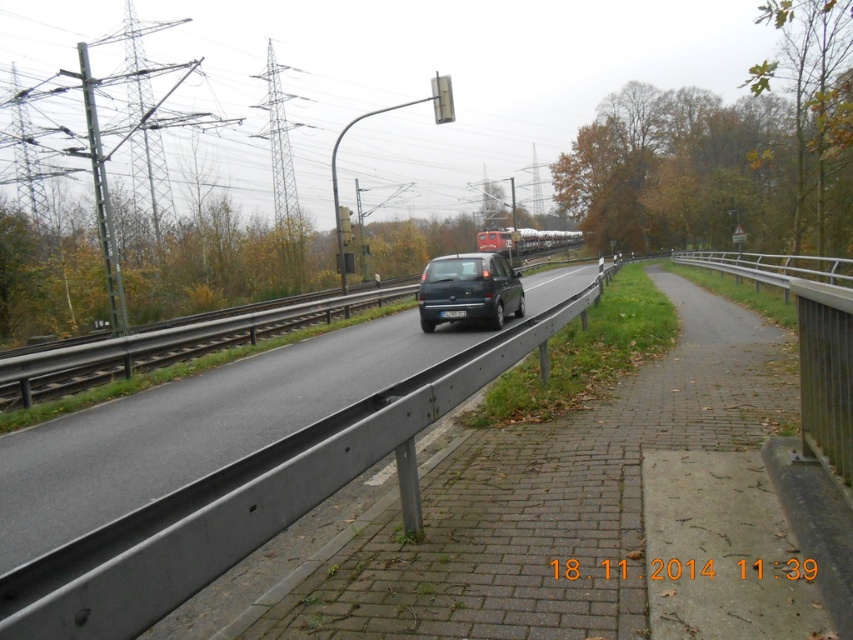
Question: Which of the following is the closest to the observer?

Choices:
 (A) (461, 288)
 (B) (350, 212)

Answer: (A)

Question: Does dark blue matte car at center appear over matte black van at center?

Choices:
 (A) yes
 (B) no

Answer: (B)

Question: Considering the relative positions of dark blue matte car at center and white plastic traffic light at upper center in the image provided, where is dark blue matte car at center located with respect to white plastic traffic light at upper center?

Choices:
 (A) right
 (B) left

Answer: (A)

Question: Which point is closer to the camera?

Choices:
 (A) (438, 316)
 (B) (431, 90)

Answer: (A)

Question: Is dark blue matte car at center behind matte black van at center?

Choices:
 (A) yes
 (B) no

Answer: (B)

Question: Which point is closer to the camera taking this photo?

Choices:
 (A) (347, 208)
 (B) (251, 314)
 (C) (436, 74)

Answer: (B)